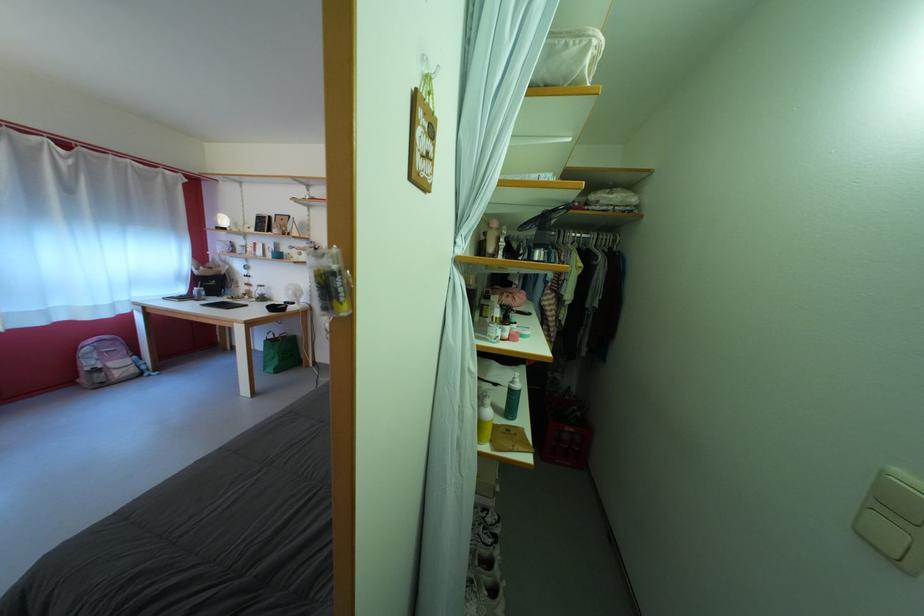
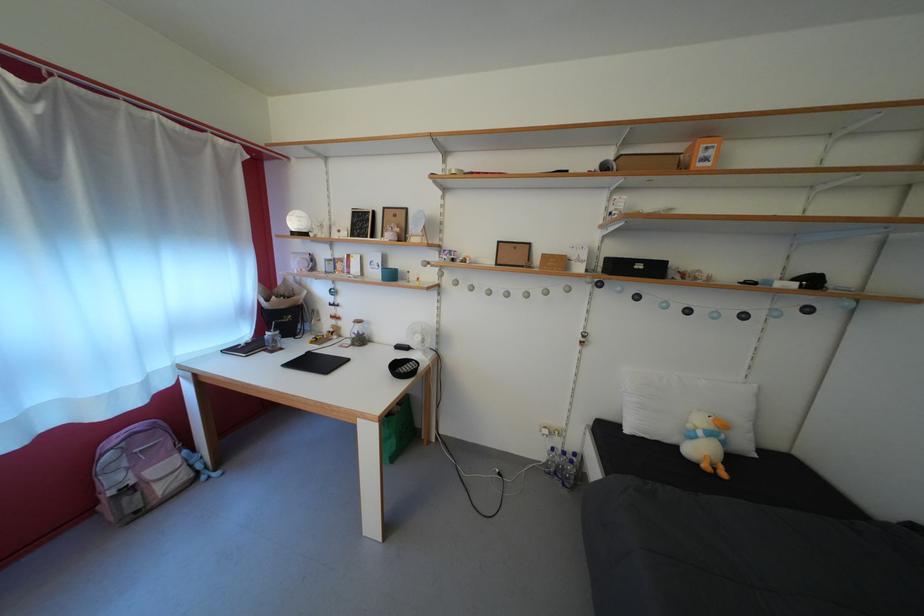
In the second image, find the point that corresponds to (x=299, y=299) in the first image.

(427, 344)